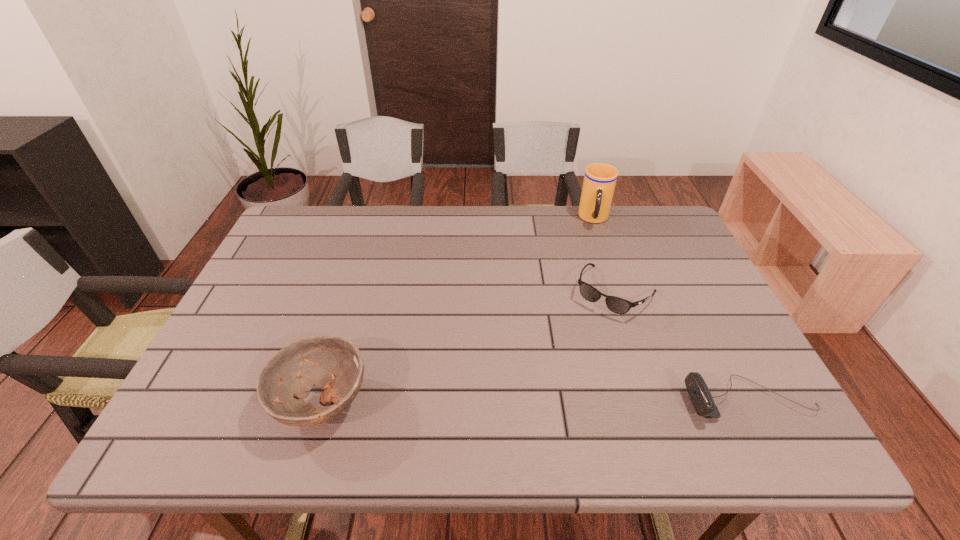
Find the location of a particular element. The width and height of the screenshot is (960, 540). vacant point that satisfies the following two spatial constraints: 1. on the back side of the bowl; 2. on the right side of the sunglasses is located at coordinates (355, 292).

The height and width of the screenshot is (540, 960). Find the location of `vacant point that satisfies the following two spatial constraints: 1. on the front side of the farthest object; 2. on the front-facing side of the webcam`. vacant point that satisfies the following two spatial constraints: 1. on the front side of the farthest object; 2. on the front-facing side of the webcam is located at coordinates (655, 400).